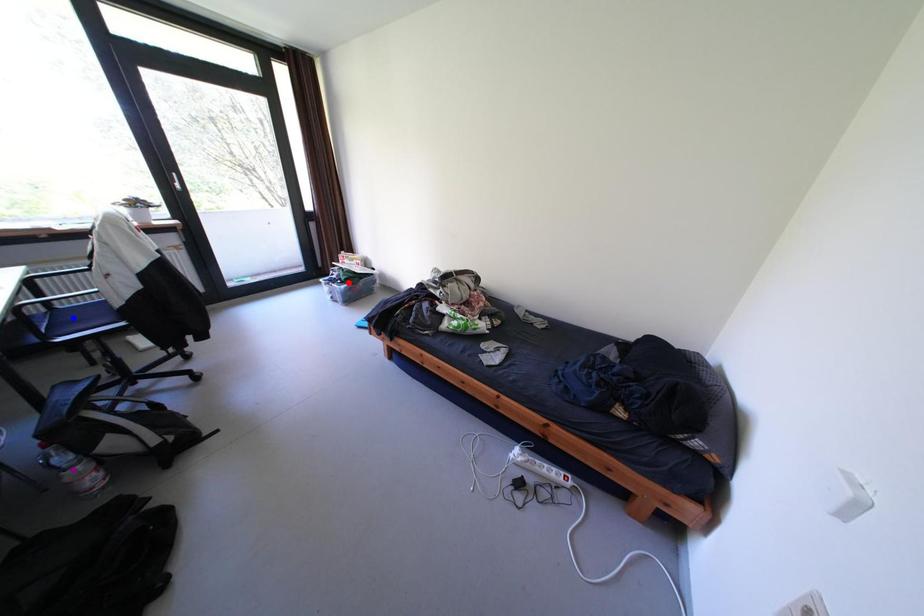
Order these from nearest to farthest:
purple point
blue point
red point

purple point, blue point, red point